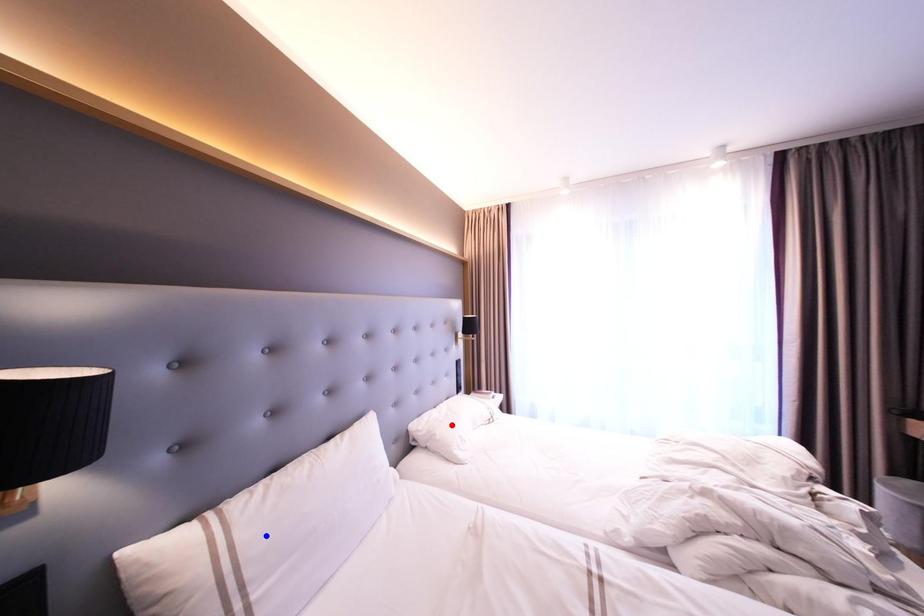
Question: Two points are marked on the image. Which point is closer to the camera?

Choices:
 (A) Blue point is closer.
 (B) Red point is closer.

Answer: (A)